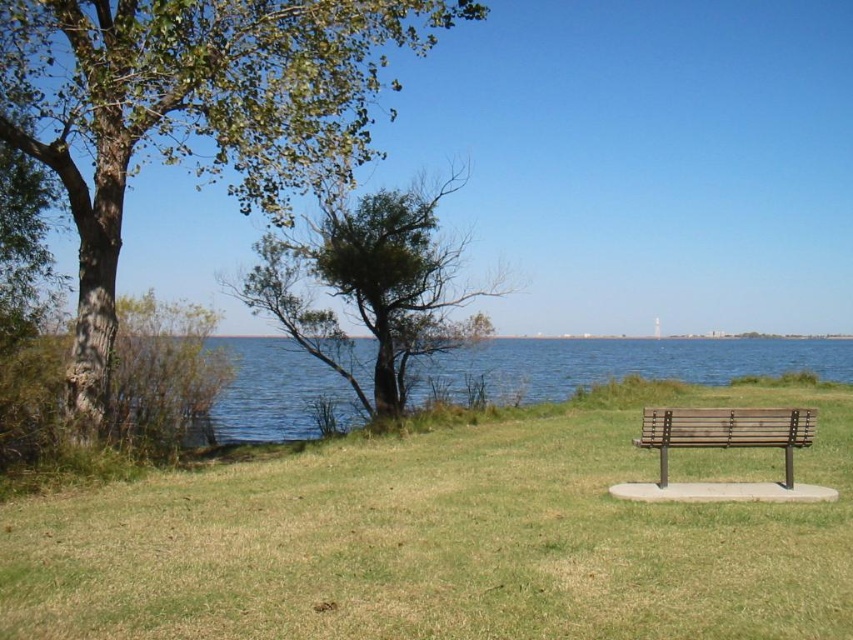
You are planning to set up a picnic blanket in the lakeside area. You want to place it where the green grass at center is shorter than the green leafy tree at left. Which area should you choose for the picnic blanket?

The green grass at center is shorter than the green leafy tree at left, so you should place the picnic blanket where the green grass at center is located.

You are planning to set up a picnic and have a large blanket that covers an area of 2 square meters. You want to place it on the green grass at center and the wooden bench at center. Which location would allow the blanket to fit entirely without overlapping?

The green grass at center has a larger size compared to the wooden bench at center, so the blanket will fit entirely on the green grass at center without overlapping.